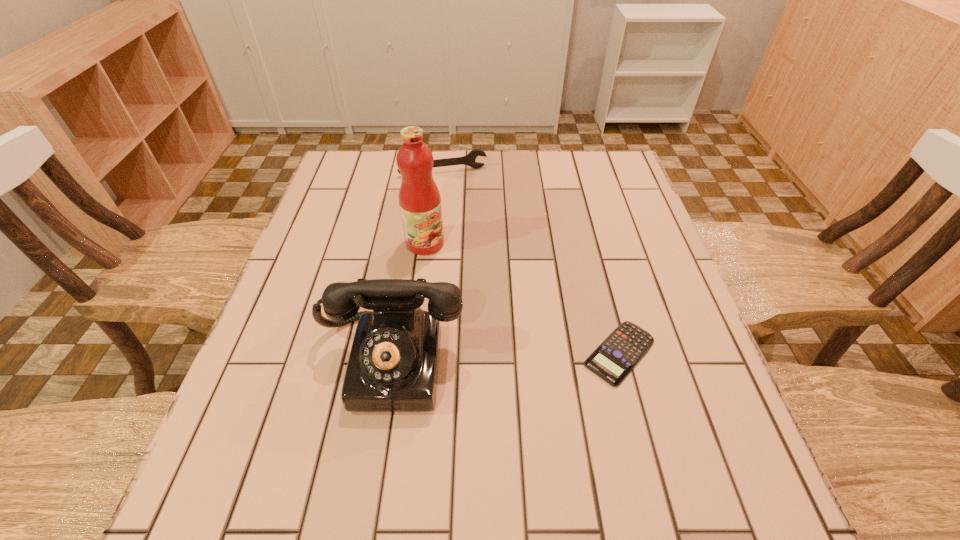
Find the location of a particular element. vacant area situated 0.330m on the open ends of the third tallest object is located at coordinates (470, 251).

Identify the location of free space located 0.120m on the front label of the tallest object. This screenshot has height=540, width=960. (463, 282).

Find the location of a particular element. The width and height of the screenshot is (960, 540). free point located 0.320m on the front label of the tallest object is located at coordinates [x=518, y=339].

Locate an element on the screen. This screenshot has height=540, width=960. vacant space situated 0.160m on the front label of the tallest object is located at coordinates (473, 292).

Identify the location of object that is at the far edge. Image resolution: width=960 pixels, height=540 pixels. (469, 159).

Image resolution: width=960 pixels, height=540 pixels. I want to click on object at the near edge, so click(393, 364).

The height and width of the screenshot is (540, 960). I want to click on object situated at the left edge, so pyautogui.click(x=393, y=364).

You are a GUI agent. You are given a task and a screenshot of the screen. Output one action in this format:
    pyautogui.click(x=<x>, y=<y>)
    Task: Click on the object present at the right edge
    The width and height of the screenshot is (960, 540).
    Given the screenshot: What is the action you would take?
    pyautogui.click(x=620, y=352)

Identify the location of object that is at the near left corner. (393, 364).

In the image, there is a desktop. Identify the location of vacant space at the far edge. 496,183.